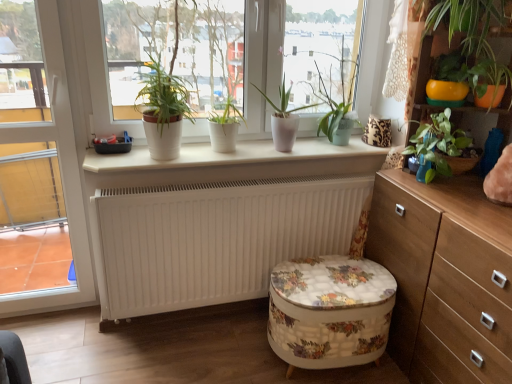
Image resolution: width=512 pixels, height=384 pixels. I want to click on white matte plant pots at center, so click(237, 57).

Image resolution: width=512 pixels, height=384 pixels. Describe the element at coordinates (60, 173) in the screenshot. I see `white glossy door at left` at that location.

This screenshot has height=384, width=512. What do you see at coordinates (284, 119) in the screenshot?
I see `pink ceramic plant pot at center, the 3th houseplant when ordered from left to right` at bounding box center [284, 119].

In the scene shown: What is the approximate width of white matte window sill at center?

white matte window sill at center is 30.26 centimeters wide.

At what (x,y) coordinates should I click in order to perform the action: click on white matte window sill at center. Please return your answer as a coordinate pair (x, y). Image resolution: width=512 pixels, height=384 pixels. Looking at the image, I should click on (228, 155).

Locate an element on the screen. The height and width of the screenshot is (384, 512). white matte radiator at center is located at coordinates (214, 238).

Is yellow plastic bowl at upper right outside of wooden chest of drawers at right?

Yes, yellow plastic bowl at upper right is not within wooden chest of drawers at right.

What's the angular difference between yellow plastic bowl at upper right and wooden chest of drawers at right's facing directions?

The facing directions of yellow plastic bowl at upper right and wooden chest of drawers at right are 1.22 degrees apart.

Is yellow plastic bowl at upper right thinner than wooden chest of drawers at right?

Yes, yellow plastic bowl at upper right is thinner than wooden chest of drawers at right.

Is yellow plastic bowl at upper right touching wooden chest of drawers at right?

No, yellow plastic bowl at upper right is not with wooden chest of drawers at right.

From a real-world perspective, does white matte window sill at center stand above white matte plant pots at center?

No, from a real-world perspective, white matte window sill at center is not above white matte plant pots at center.

Is white matte window sill at center completely or partially outside of white matte plant pots at center?

Yes, white matte window sill at center is located beyond the bounds of white matte plant pots at center.

Could you tell me if white matte window sill at center is facing white matte plant pots at center?

No.

Considering the positions of point (175, 167) and point (115, 102), is point (175, 167) closer or farther from the camera than point (115, 102)?

Point (175, 167) is closer to the camera than point (115, 102).

Considering the sizes of objects white matte radiator at center and floral fabric ottoman at center in the image provided, who is bigger, white matte radiator at center or floral fabric ottoman at center?

With larger size is white matte radiator at center.

Considering their positions, is white matte radiator at center located in front of or behind floral fabric ottoman at center?

Clearly, white matte radiator at center is behind floral fabric ottoman at center.

Which is behind, point (204, 273) or point (358, 277)?

The point (204, 273) is more distant.

Which is more to the right, white matte radiator at center or floral fabric ottoman at center?

Positioned to the right is floral fabric ottoman at center.

Considering the sizes of objects matte white pot at upper left, the first houseplant viewed from the left, and white matte radiator at center in the image provided, who is smaller, matte white pot at upper left, the first houseplant viewed from the left, or white matte radiator at center?

Smaller between the two is matte white pot at upper left, the first houseplant viewed from the left.

How different are the orientations of matte white pot at upper left, the first houseplant viewed from the left, and white matte radiator at center in degrees?

The angle between the facing direction of matte white pot at upper left, the first houseplant viewed from the left, and the facing direction of white matte radiator at center is 0.384 degrees.

Is matte white pot at upper left, the first houseplant viewed from the left, completely or partially outside of white matte radiator at center?

matte white pot at upper left, the first houseplant viewed from the left, is positioned outside white matte radiator at center.

From their relative heights in the image, would you say matte white pot at upper left, the fifth houseplant when ordered from right to left, is taller or shorter than white matte radiator at center?

Considering their sizes, matte white pot at upper left, the fifth houseplant when ordered from right to left, has more height than white matte radiator at center.

Is white glossy door at left further to the viewer compared to white matte pot at center, acting as the 4th houseplant starting from the right?

That is False.

Considering the sizes of white glossy door at left and white matte pot at center, the 2th houseplant when ordered from left to right, in the image, is white glossy door at left bigger or smaller than white matte pot at center, the 2th houseplant when ordered from left to right,?

white glossy door at left is bigger than white matte pot at center, the 2th houseplant when ordered from left to right.

How distant is white glossy door at left from white matte pot at center, acting as the 4th houseplant starting from the right?

A distance of 29.43 inches exists between white glossy door at left and white matte pot at center, acting as the 4th houseplant starting from the right.

Is point (34, 138) more distant than point (213, 113)?

Yes.

Consider the image. How much distance is there between white glossy door at left and pink ceramic plant pot at center, which is the 3th houseplant from right to left?

1.00 meters.

Considering the sizes of objects white glossy door at left and pink ceramic plant pot at center, the 3th houseplant when ordered from left to right, in the image provided, who is taller, white glossy door at left or pink ceramic plant pot at center, the 3th houseplant when ordered from left to right,?

With more height is white glossy door at left.

Would you say white glossy door at left is inside or outside pink ceramic plant pot at center, the 3th houseplant when ordered from left to right?

A: white glossy door at left lies outside pink ceramic plant pot at center, the 3th houseplant when ordered from left to right.

Could you measure the distance between pink ceramic plant pot at center, the 3th houseplant when ordered from left to right, and white glossy door at left?

pink ceramic plant pot at center, the 3th houseplant when ordered from left to right, and white glossy door at left are 1.00 meters apart from each other.

Based on the photo, is pink ceramic plant pot at center, the 3th houseplant when ordered from left to right, spatially inside white glossy door at left, or outside of it?

pink ceramic plant pot at center, the 3th houseplant when ordered from left to right, is spatially situated outside white glossy door at left.

Are pink ceramic plant pot at center, which is the 3th houseplant from right to left, and white glossy door at left located far from each other?

That's right, there is a large distance between pink ceramic plant pot at center, which is the 3th houseplant from right to left, and white glossy door at left.

At what (x,y) coordinates should I click in order to perform the action: click on chest of drawers below the yellow plastic bowl at upper right (from the image's perspective). Please return your answer as a coordinate pair (x, y). The height and width of the screenshot is (384, 512). Looking at the image, I should click on [x=445, y=277].

The width and height of the screenshot is (512, 384). What are the coordinates of `window sill located behind the white matte plant pots at center` in the screenshot? It's located at click(228, 155).

Looking at the image, which one is located further to white glossy door at left, yellow plastic bowl at upper right or wooden chest of drawers at right?

yellow plastic bowl at upper right lies further to white glossy door at left than the other object.

Considering their positions, is wooden chest of drawers at right positioned further to pink ceramic plant pot at center, the 3th houseplant when ordered from left to right, than white glossy door at left?

white glossy door at left is positioned further to the anchor pink ceramic plant pot at center, the 3th houseplant when ordered from left to right.

Considering their positions, is white matte plant pots at center positioned further to white matte radiator at center than matte white pot at upper left, the first houseplant viewed from the left?

white matte plant pots at center is further to white matte radiator at center.

Considering their positions, is orange plastic pot at upper right, marked as the 5th houseplant in a left-to-right arrangement, positioned further to floral fabric ottoman at center than pink ceramic plant pot at center, which is the 3th houseplant from right to left?

Based on the image, orange plastic pot at upper right, marked as the 5th houseplant in a left-to-right arrangement, appears to be further to floral fabric ottoman at center.

Which object lies nearer to the anchor point yellow plastic bowl at upper right, matte white pot at upper left, the first houseplant viewed from the left, or white matte radiator at center?

The object closer to yellow plastic bowl at upper right is white matte radiator at center.

When comparing their distances from white matte pot at center, the 2th houseplant when ordered from left to right, does white matte plant pots at center or white matte radiator at center seem further?

white matte radiator at center is positioned further to the anchor white matte pot at center, the 2th houseplant when ordered from left to right.

Based on their spatial positions, is white glossy door at left or white matte plant pots at center further from floral fabric ottoman at center?

white glossy door at left lies further to floral fabric ottoman at center than the other object.

Considering their positions, is white matte radiator at center positioned closer to white glossy door at left than matte white pot at upper left, the fifth houseplant when ordered from right to left?

matte white pot at upper left, the fifth houseplant when ordered from right to left, is closer to white glossy door at left.

What are the coordinates of `radiator between white matte plant pots at center and floral fabric ottoman at center in the up-down direction` in the screenshot? It's located at (214, 238).

Identify the location of window sill between matte white pot at upper left, the first houseplant viewed from the left, and orange plastic pot at upper right, positioned as the 1th houseplant in right-to-left order, in the horizontal direction. Image resolution: width=512 pixels, height=384 pixels. (228, 155).

Identify the location of swivel chair situated between white glossy door at left and orange plastic pot at upper right, positioned as the 1th houseplant in right-to-left order, from left to right. (329, 311).

What are the coordinates of `radiator between pink ceramic plant pot at center, the 3th houseplant when ordered from left to right, and floral fabric ottoman at center in the up-down direction` in the screenshot? It's located at (214, 238).